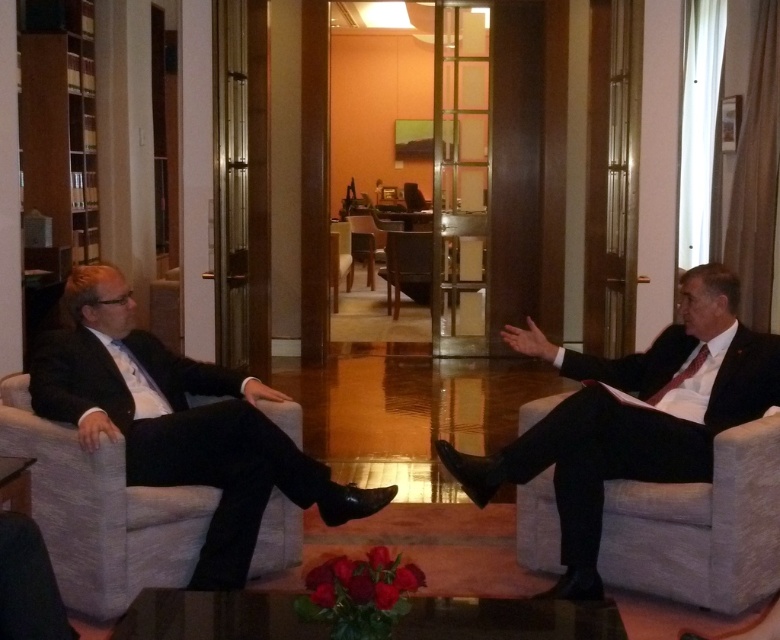
You are an interior designer planning to place a new table between the wooden textured chair at center and the wooden chair at center. Based on their positions, which chair should the table be placed closer to?

The wooden textured chair at center is located below the wooden chair at center, so the table should be placed closer to the wooden chair at center to align with its elevated position.